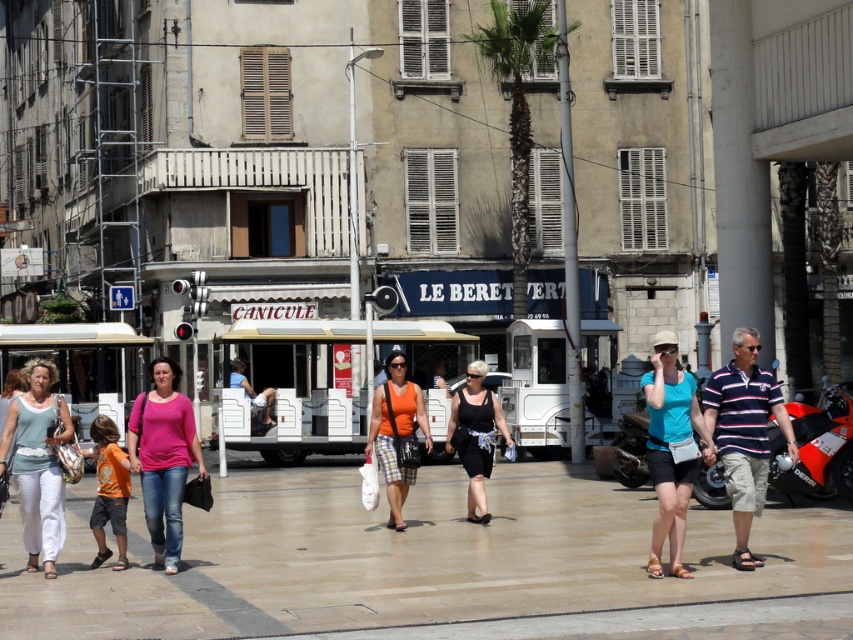
You are a photographer standing in the pedestrian plaza. You want to capture a photo where the matte white pants at lower left and the blue matte tank top at center are both visible. Based on their positions, which one will appear closer to the bottom edge of the photo?

The matte white pants at lower left is below the blue matte tank top at center, so it will appear closer to the bottom edge of the photo.

You are a photographer standing in the pedestrian plaza. You want to take a photo that includes both the matte white pants at lower left and the orange shirt at center. Which object should you focus on first to ensure both are in frame?

The matte white pants at lower left is positioned over the orange shirt at center, so you should focus on the matte white pants at lower left first to ensure both are in frame.